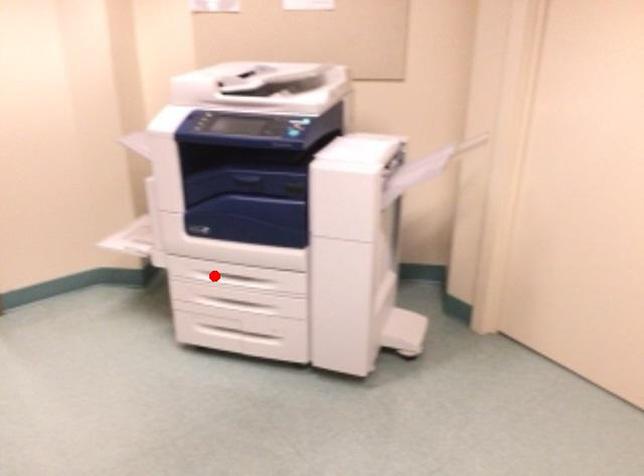
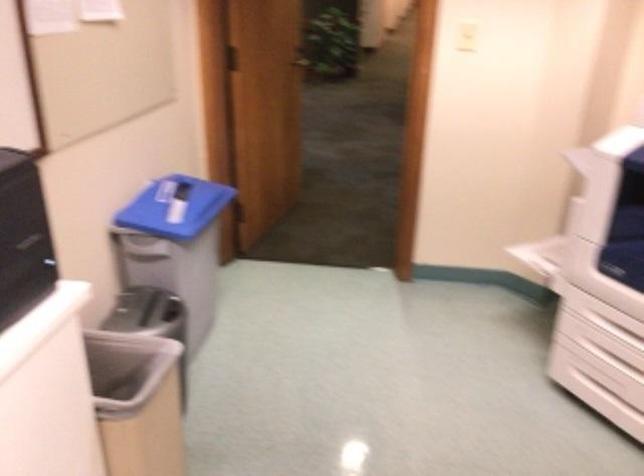
Where in the second image is the point corresponding to the highlighted location from the first image?

(618, 330)